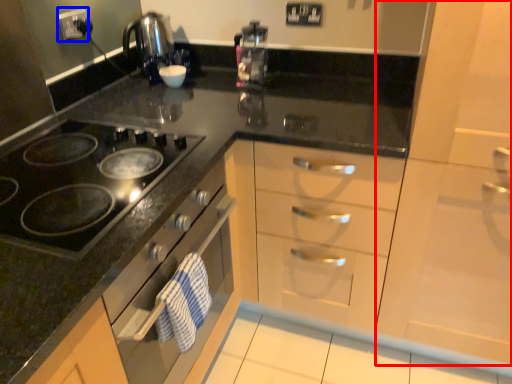
Question: Which object appears closest to the camera in this image, cabinetry (highlighted by a red box) or electric outlet (highlighted by a blue box)?

Choices:
 (A) cabinetry
 (B) electric outlet

Answer: (A)